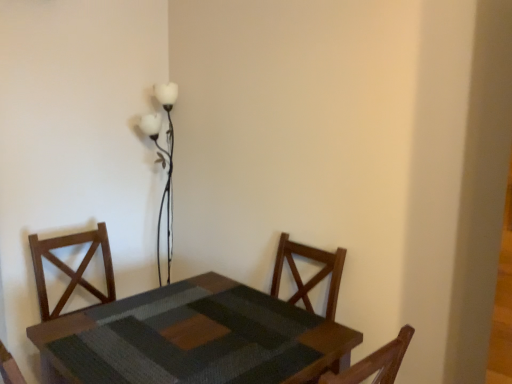
Where is `vacant space situated above wooden textured table at center (from a real-world perspective)`? This screenshot has width=512, height=384. vacant space situated above wooden textured table at center (from a real-world perspective) is located at coordinates (182, 338).